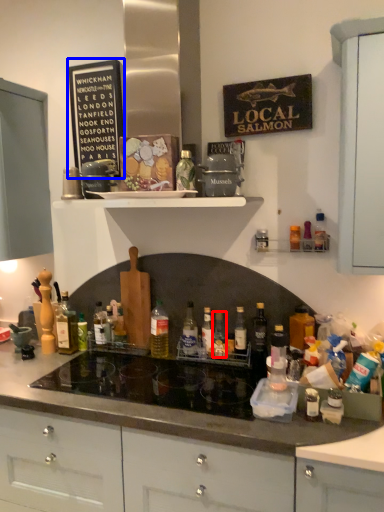
Question: Which object is further to the camera taking this photo, bottle (highlighted by a red box) or bulletin board (highlighted by a blue box)?

Choices:
 (A) bottle
 (B) bulletin board

Answer: (B)